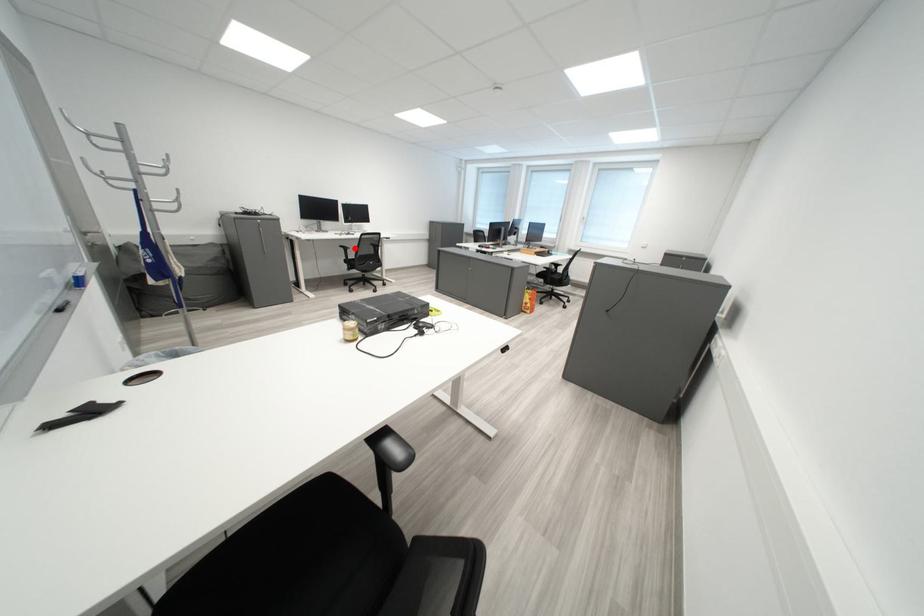
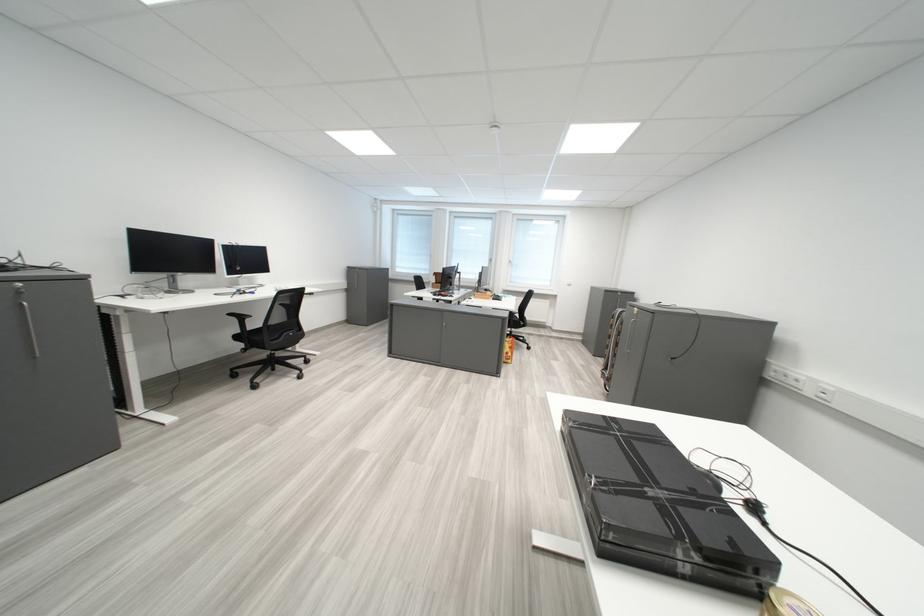
Question: I am providing you with two images of the same scene from different viewpoints. Given a red point in image1, look at the same physical point in image2. Is it:

Choices:
 (A) Closer to the viewpoint
 (B) Farther from the viewpoint

Answer: (B)